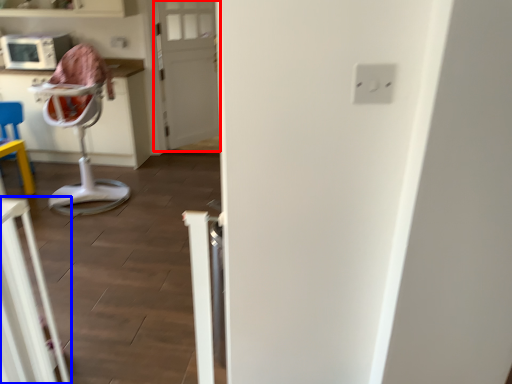
Question: Which object is further to the camera taking this photo, door (highlighted by a red box) or furniture (highlighted by a blue box)?

Choices:
 (A) door
 (B) furniture

Answer: (A)